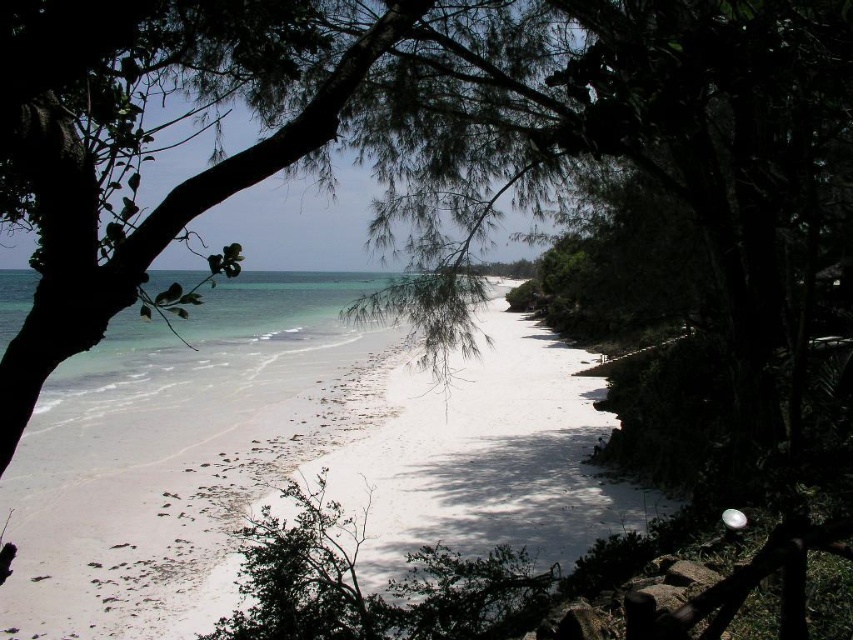
Question: Which of the following is the farthest from the observer?

Choices:
 (A) (65, 483)
 (B) (274, 40)

Answer: (A)

Question: Among these points, which one is farthest from the camera?

Choices:
 (A) click(374, 52)
 (B) click(53, 540)

Answer: (B)

Question: Can you confirm if white sand beach at center is thinner than green leafy tree at center?

Choices:
 (A) no
 (B) yes

Answer: (A)

Question: Can you confirm if white sand beach at center is thinner than green leafy tree at center?

Choices:
 (A) yes
 (B) no

Answer: (B)

Question: Can you confirm if white sand beach at center is positioned above green leafy tree at center?

Choices:
 (A) no
 (B) yes

Answer: (A)